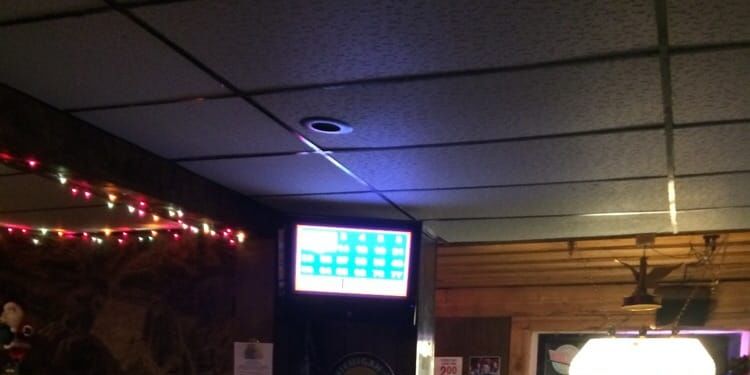
The width and height of the screenshot is (750, 375). Find the location of `circular ceiling light fitting`. circular ceiling light fitting is located at coordinates (344, 129).